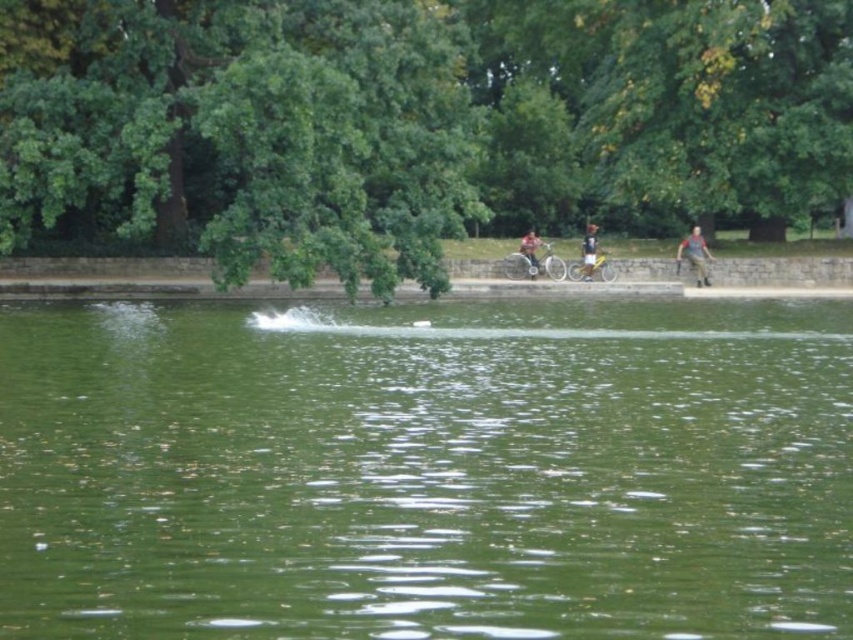
You are planning to take a photo of the green leafy tree at upper center and the matte black bicycle at center. Which object should you focus on first if you want to capture both in a single frame without moving the camera?

The green leafy tree at upper center is larger in size than the matte black bicycle at center, so you should focus on the green leafy tree at upper center first to ensure it fits properly in the frame.